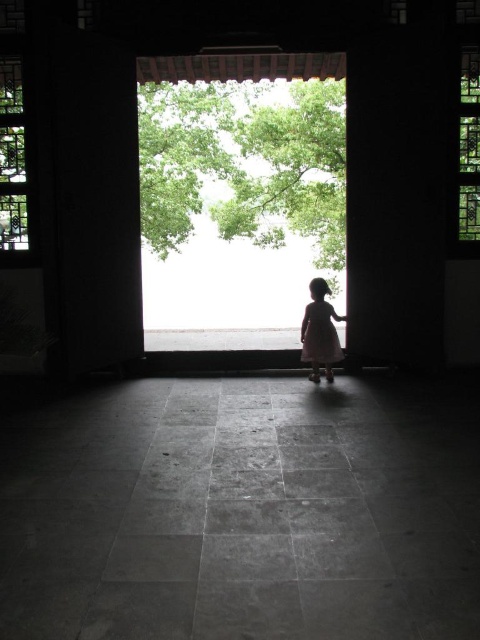
Question: Which point is closer to the camera taking this photo?

Choices:
 (A) (188, 195)
 (B) (322, 330)

Answer: (B)

Question: Which is nearer to the green leafy tree at center?

Choices:
 (A) white matte dress at center
 (B) green stained glass window at upper right

Answer: (B)

Question: Which of these objects is positioned farthest from the white matte dress at center?

Choices:
 (A) translucent glass window at left
 (B) green leafy tree at center

Answer: (B)

Question: Is translucent glass window at left to the right of white matte dress at center from the viewer's perspective?

Choices:
 (A) no
 (B) yes

Answer: (A)

Question: Does translucent glass window at left lie behind white matte dress at center?

Choices:
 (A) yes
 (B) no

Answer: (B)

Question: Considering the relative positions of green stained glass window at upper right and white matte dress at center in the image provided, where is green stained glass window at upper right located with respect to white matte dress at center?

Choices:
 (A) below
 (B) above

Answer: (B)